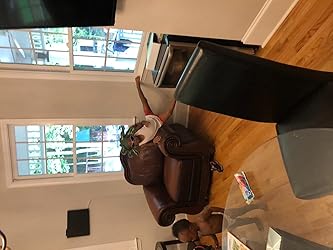
Image resolution: width=333 pixels, height=250 pixels. What are the coordinates of `brown leather chair` in the screenshot? It's located at (167, 168).